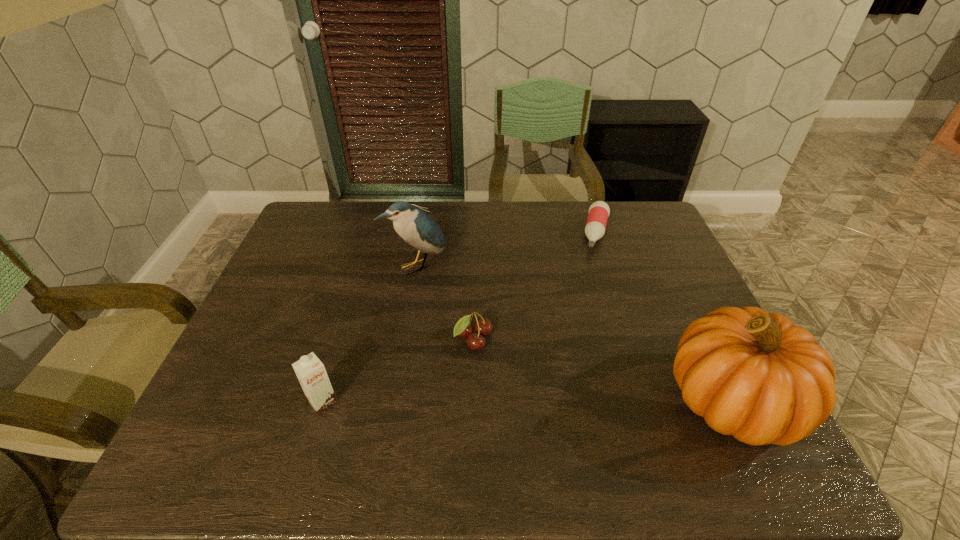
This screenshot has width=960, height=540. Identify the location of object that ranks as the fourth closest to the cherry. (599, 211).

Where is `free space that satisfies the following two spatial constraints: 1. on the front side of the pumpkin; 2. on the right side of the bottle`? free space that satisfies the following two spatial constraints: 1. on the front side of the pumpkin; 2. on the right side of the bottle is located at coordinates (652, 400).

Locate an element on the screen. This screenshot has width=960, height=540. blank space that satisfies the following two spatial constraints: 1. on the back side of the bottle; 2. on the left side of the bird is located at coordinates (422, 233).